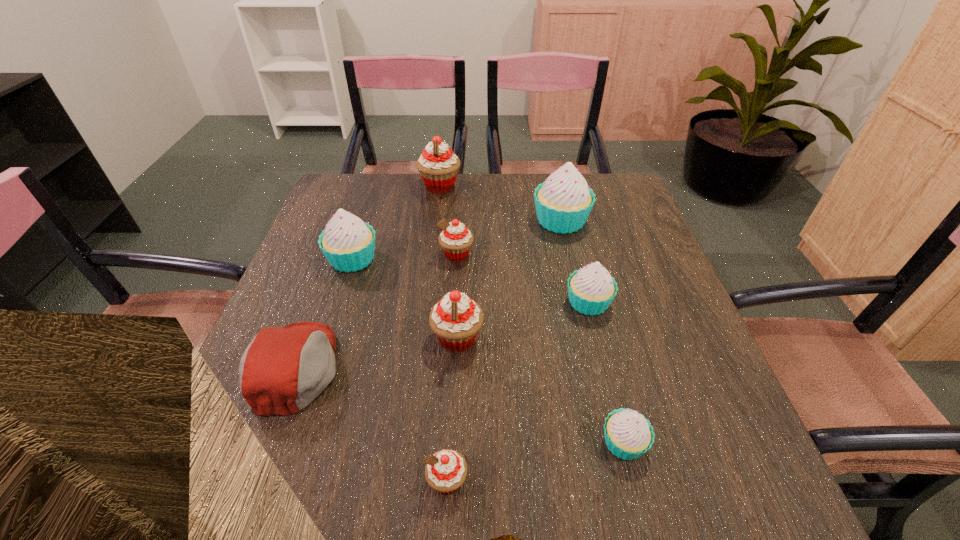
Where is `the nearest white cupcake`? The height and width of the screenshot is (540, 960). the nearest white cupcake is located at coordinates (628, 434).

You are a GUI agent. You are given a task and a screenshot of the screen. Output one action in this format:
    pyautogui.click(x=<x>, y=<y>)
    Task: Click on the smallest pink cupcake
    
    Given the screenshot: What is the action you would take?
    pyautogui.click(x=446, y=470)

At what (x,y) coordinates should I click in order to perform the action: click on vacant space located on the left of the farthest object. Please return your answer as a coordinate pair (x, y). The image size is (960, 540). Looking at the image, I should click on (374, 186).

At what (x,y) coordinates should I click in order to perform the action: click on vacant region located 0.170m on the back of the seventh nearest cupcake. Please return your answer as a coordinate pair (x, y). Looking at the image, I should click on (550, 175).

Where is `vacant space located on the right of the second biggest white cupcake`? This screenshot has width=960, height=540. vacant space located on the right of the second biggest white cupcake is located at coordinates (514, 259).

Locate an element on the screen. vacant space situated 0.360m on the back of the second biggest pink cupcake is located at coordinates (463, 222).

I want to click on blank space located 0.200m on the front of the third farthest white cupcake, so click(612, 401).

Locate an element on the screen. Image resolution: width=960 pixels, height=540 pixels. free space located on the front of the second smallest pink cupcake is located at coordinates (454, 297).

I want to click on free space located on the front-facing side of the red cap, so click(384, 368).

Locate an element on the screen. The image size is (960, 540). free location located 0.380m on the back of the smallest white cupcake is located at coordinates (583, 277).